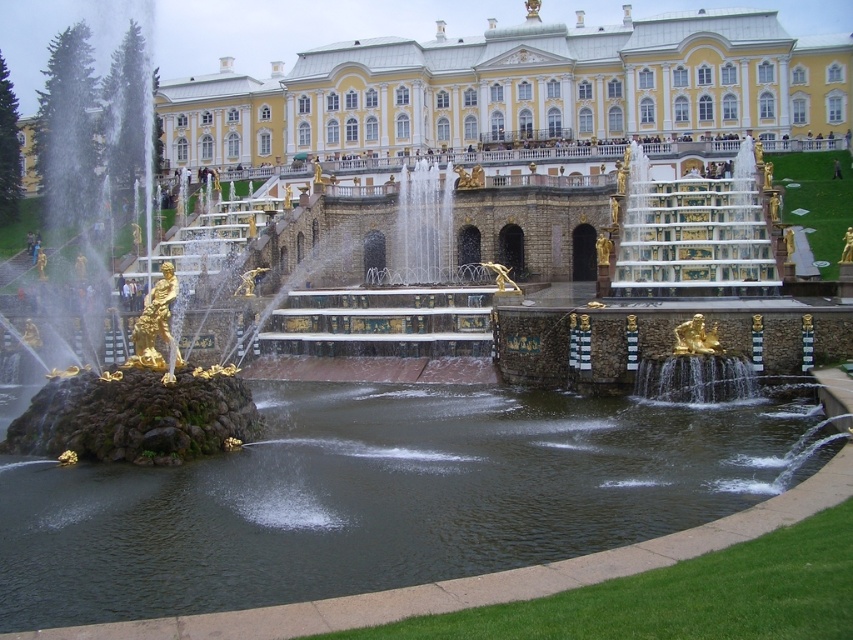
Question: Does white glossy palace at center appear on the right side of dark brown stone fountain at center?

Choices:
 (A) no
 (B) yes

Answer: (A)

Question: Which point is closer to the camera?

Choices:
 (A) (792, 51)
 (B) (332, 360)

Answer: (B)

Question: In this image, where is white glossy palace at center located relative to dark brown stone fountain at center?

Choices:
 (A) above
 (B) below

Answer: (A)

Question: Can you confirm if white glossy palace at center is smaller than dark brown stone fountain at center?

Choices:
 (A) no
 (B) yes

Answer: (A)

Question: Which point is farther from the camera taking this photo?

Choices:
 (A) (775, 525)
 (B) (322, 77)

Answer: (B)

Question: Which point is closer to the camera?

Choices:
 (A) (434, 90)
 (B) (436, 365)

Answer: (B)